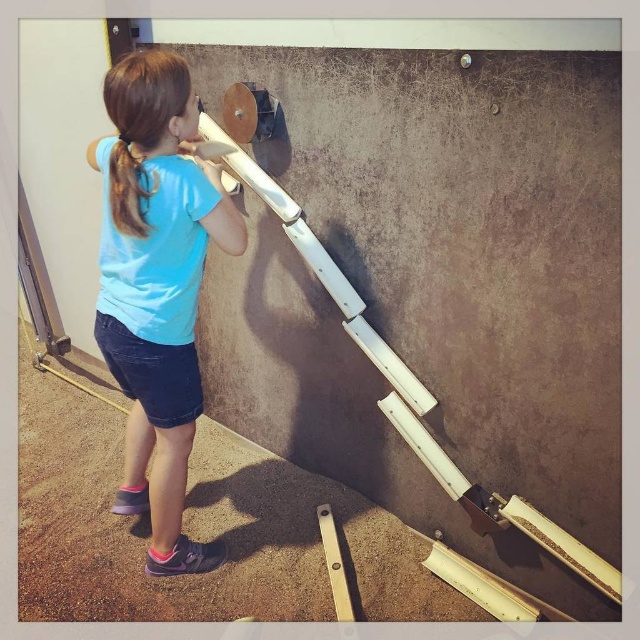
Question: From the image, what is the correct spatial relationship of blue fabric shirt at center in relation to brown hair at upper left?

Choices:
 (A) above
 (B) below

Answer: (B)

Question: Which point is closer to the camera?

Choices:
 (A) blue fabric shirt at center
 (B) brown hair at upper left

Answer: (A)

Question: Is blue fabric shirt at center smaller than brown hair at upper left?

Choices:
 (A) no
 (B) yes

Answer: (A)

Question: Does blue fabric shirt at center have a larger size compared to brown hair at upper left?

Choices:
 (A) no
 (B) yes

Answer: (B)

Question: Which object is farther from the camera taking this photo?

Choices:
 (A) blue fabric shirt at center
 (B) brown hair at upper left

Answer: (B)